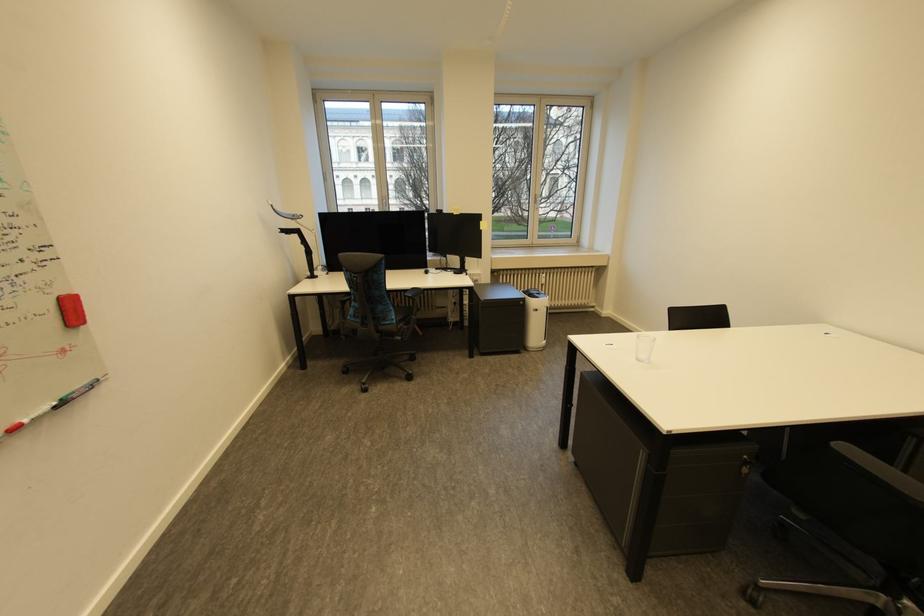
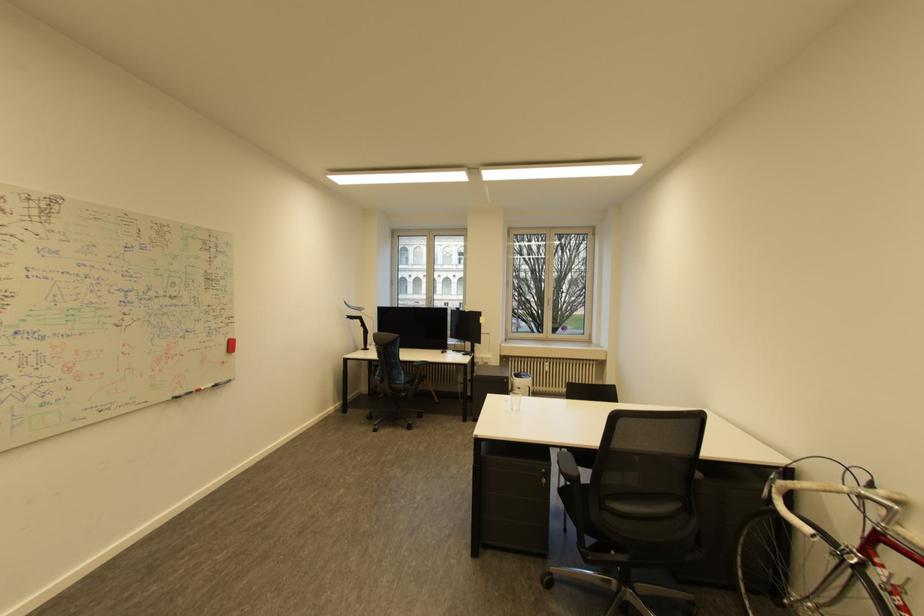
In a continuous first-person perspective shot, in which direction is the camera moving?

The cameraman walked toward right, backward.